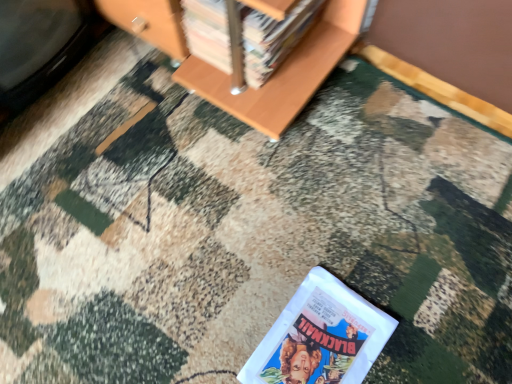
Identify the location of free space behind white glossy book at lower center, the first book positioned from the bottom. (311, 246).